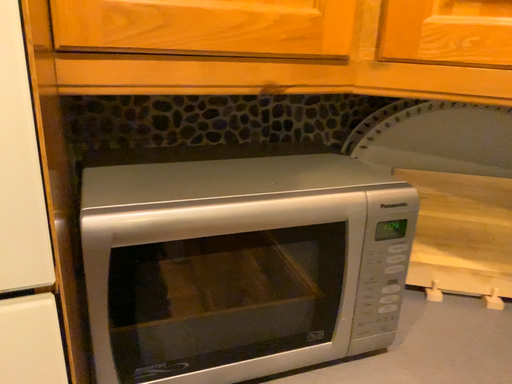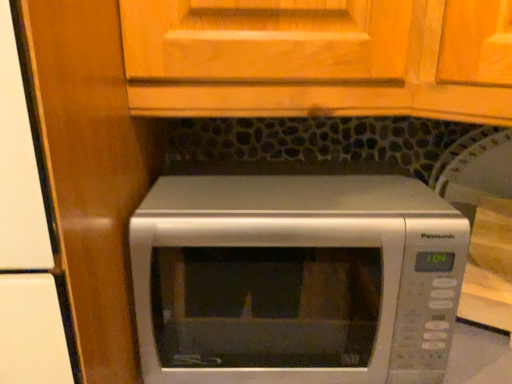
Question: How did the camera likely rotate when shooting the video?

Choices:
 (A) rotated right
 (B) rotated left

Answer: (B)